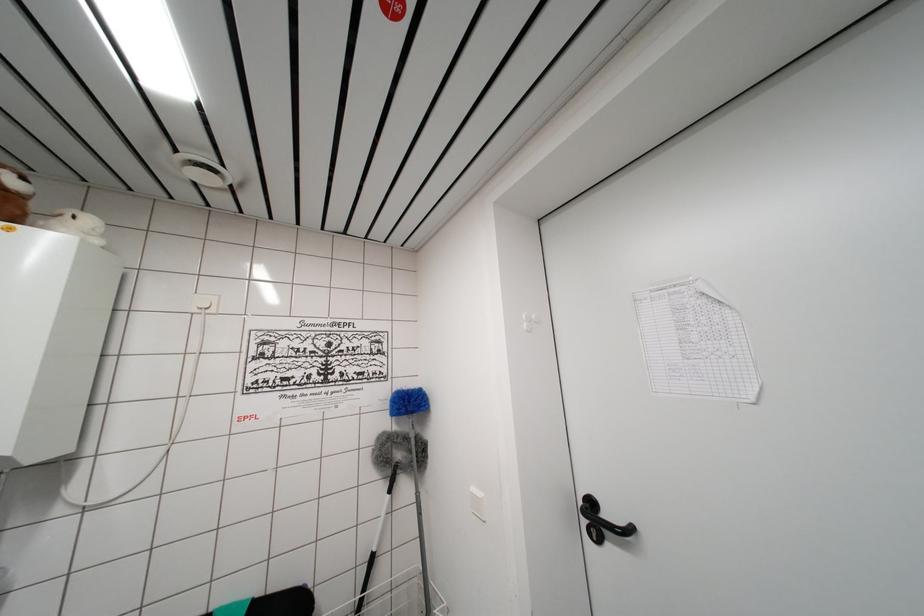
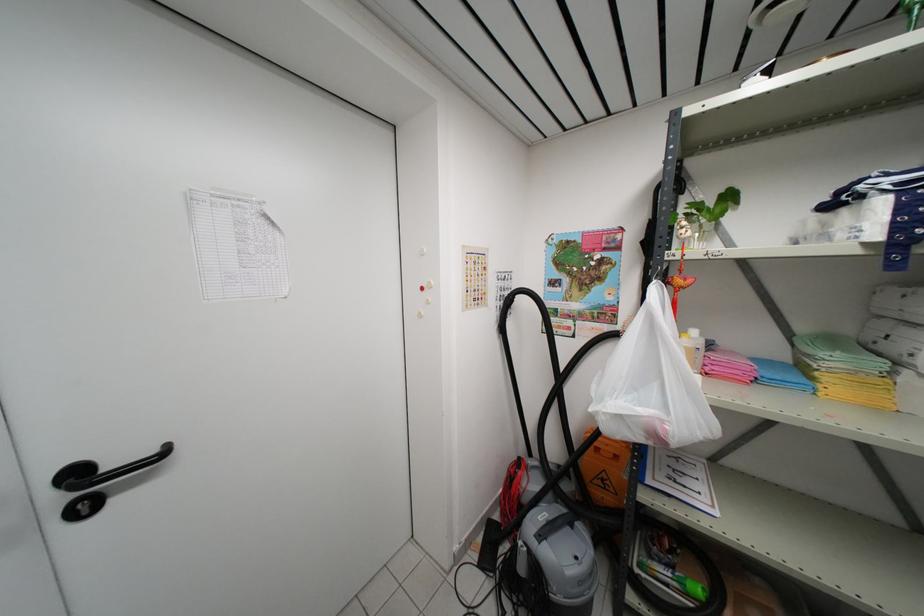
Where in the second image is the point corresponding to (594,535) from the first image?

(83, 512)